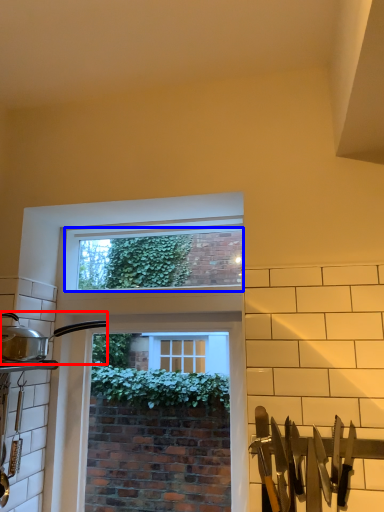
Question: Among these objects, which one is farthest to the camera, kitchen appliance (highlighted by a red box) or window screen (highlighted by a blue box)?

Choices:
 (A) kitchen appliance
 (B) window screen

Answer: (B)